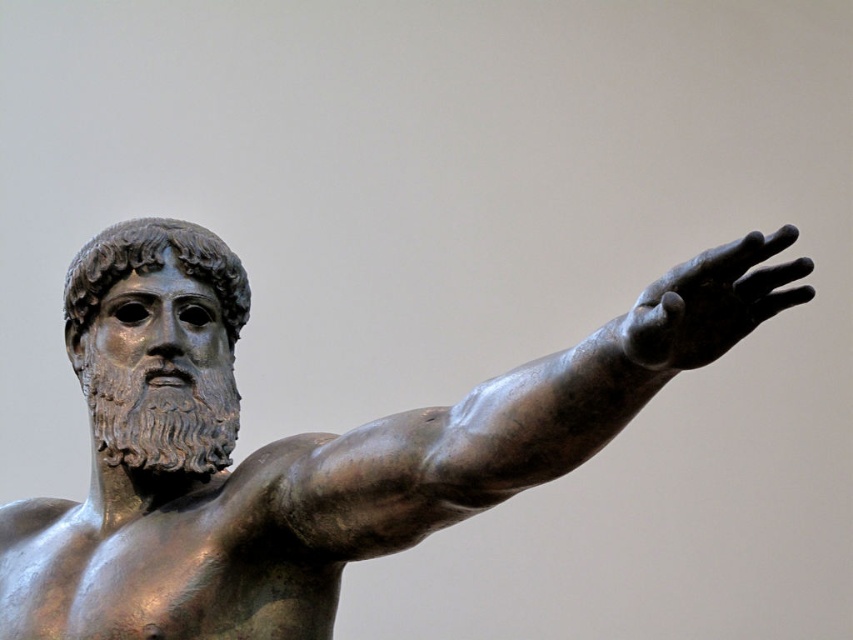
From the picture: You are standing in front of the bronze statue and need to determine its exact position. According to the coordinates provided, where is the shiny bronze statue at center located?

The shiny bronze statue at center is located at point coordinates of (308, 444).

You are an art conservator examining the bronze statue. You notice two points on the statue marked as point 1 at coordinates point (175, 416) and point 2 at coordinates point (758, 248). From your vantage point, which point is closer to you?

Point (758, 248) is closer to you because it is in front of point (175, 416).

You are an art conservator assessing the statue. You need to determine if the bronze hand at upper right can fit horizontally within the width of the shiny bronze statue at center. Based on the provided information, can it?

The shiny bronze statue at center is wider than the bronze hand at upper right, so yes, the bronze hand at upper right can fit horizontally within the width of the shiny bronze statue at center.